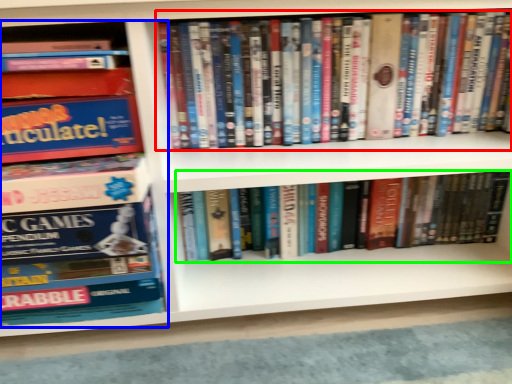
Question: Estimate the real-world distances between objects in this image. Which object is closer to book (highlighted by a red box), book (highlighted by a blue box) or book (highlighted by a green box)?

Choices:
 (A) book
 (B) book

Answer: (B)